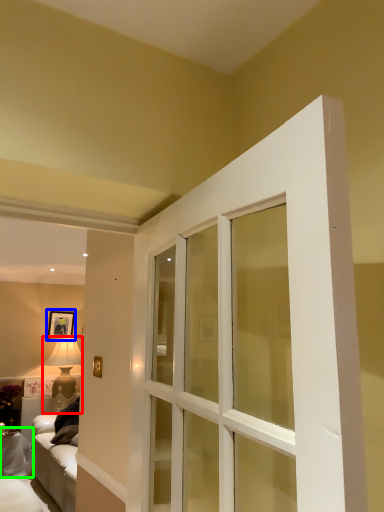
Question: Which is farther away from lamp (highlighted by a red box)? picture frame (highlighted by a blue box) or furniture (highlighted by a green box)?

Choices:
 (A) picture frame
 (B) furniture

Answer: (B)